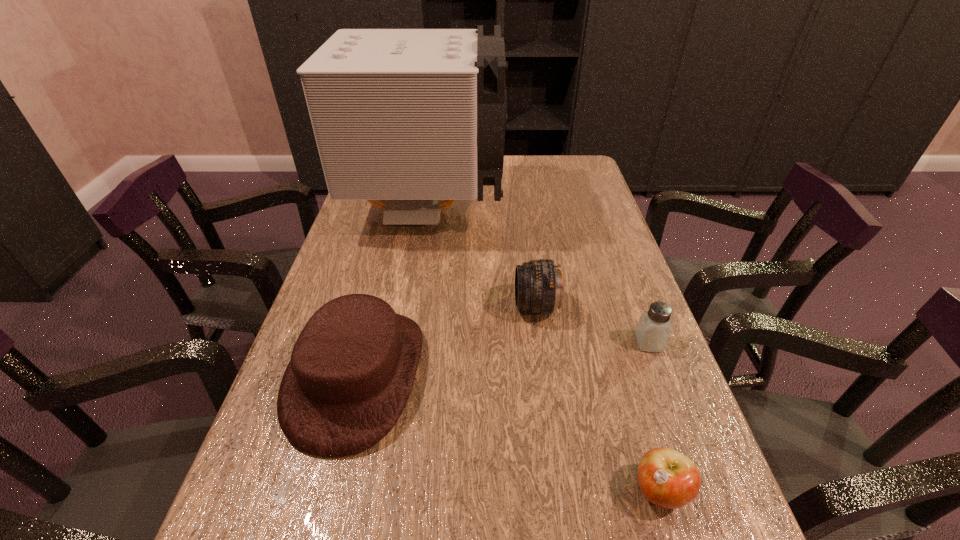
Where is `vacant space that's between the fourth tallest object and the hat`? The image size is (960, 540). vacant space that's between the fourth tallest object and the hat is located at coordinates (503, 359).

The image size is (960, 540). What are the coordinates of `object that is the second closest to the tallest object` in the screenshot? It's located at (352, 368).

This screenshot has height=540, width=960. In order to click on object that can be found as the fourth closest to the fan in this screenshot , I will do `click(667, 478)`.

Where is `vacant region that satisfies the following two spatial constraints: 1. at the front element of the third object from right to left; 2. on the back side of the shortest object`? The height and width of the screenshot is (540, 960). vacant region that satisfies the following two spatial constraints: 1. at the front element of the third object from right to left; 2. on the back side of the shortest object is located at coordinates (561, 490).

Locate an element on the screen. Image resolution: width=960 pixels, height=540 pixels. vacant point that satisfies the following two spatial constraints: 1. at the front element of the telephoto lens; 2. on the left side of the shortest object is located at coordinates (561, 490).